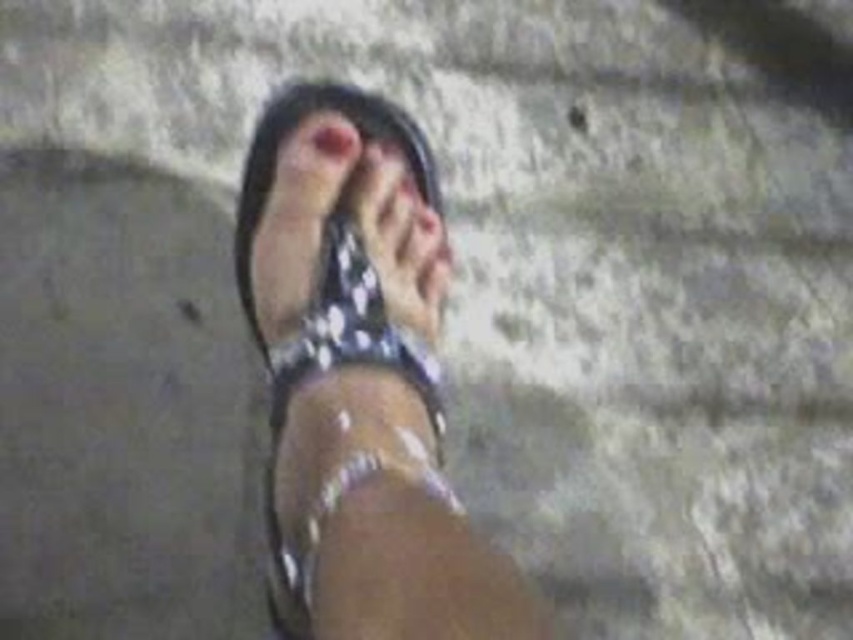
Where is the shiny metallic sandal at center located in the image?

The shiny metallic sandal at center is located at point (x=360, y=380) in the image.

You are trying to choose between two items for an outfit. You have a matte black sandal at center and a pink matte toe at center. If you want to prioritize comfort for a day at the beach, which one would you choose based on their sizes?

The matte black sandal at center is larger than the pink matte toe at center, so it would be more comfortable for a day at the beach.

You are a photographer trying to capture the matte black sandal at center and the pink matte toe at center in focus. Since the background is blurred, which object should you adjust your camera focus on to ensure both are sharp?

The matte black sandal at center has a larger size compared to the pink matte toe at center, so you should focus on the matte black sandal at center to ensure both are in sharp focus.